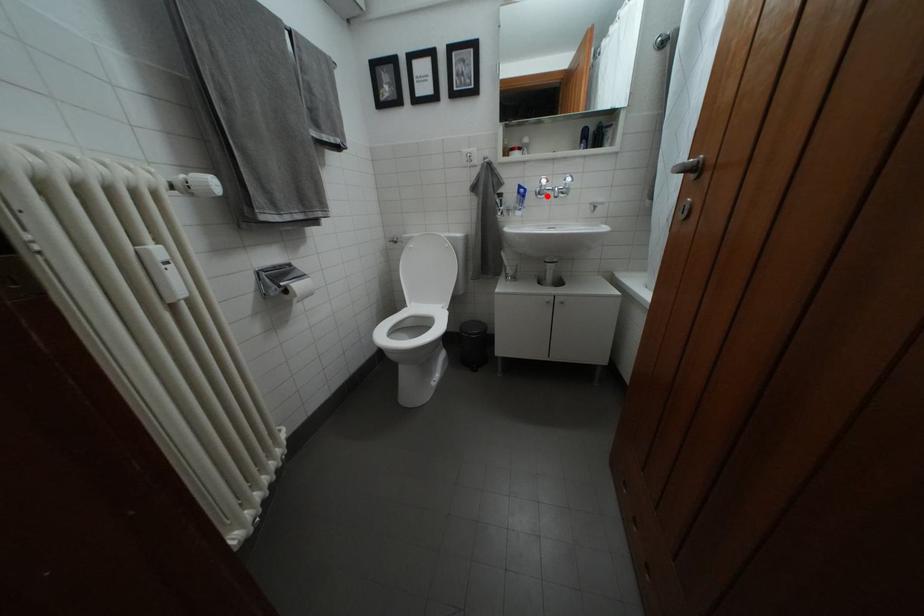
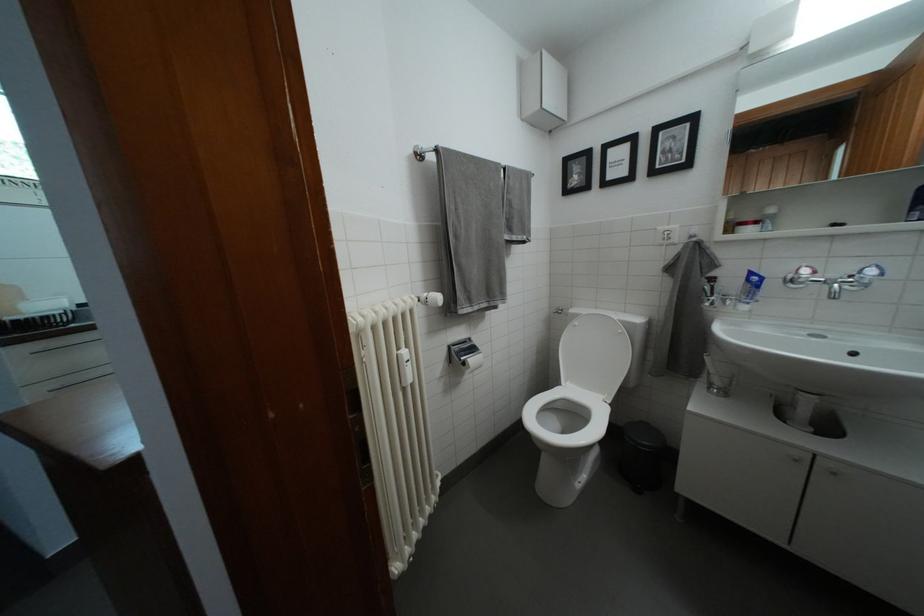
Question: I am providing you with two images of the same scene from different viewpoints. A red point is shown in image1. For the corresponding object point in image2, is it positioned nearer or farther from the camera?

Choices:
 (A) Nearer
 (B) Farther

Answer: (B)